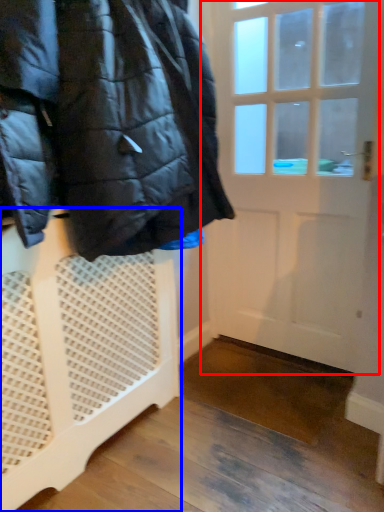
Question: Which object appears closest to the camera in this image, door (highlighted by a red box) or furniture (highlighted by a blue box)?

Choices:
 (A) door
 (B) furniture

Answer: (B)